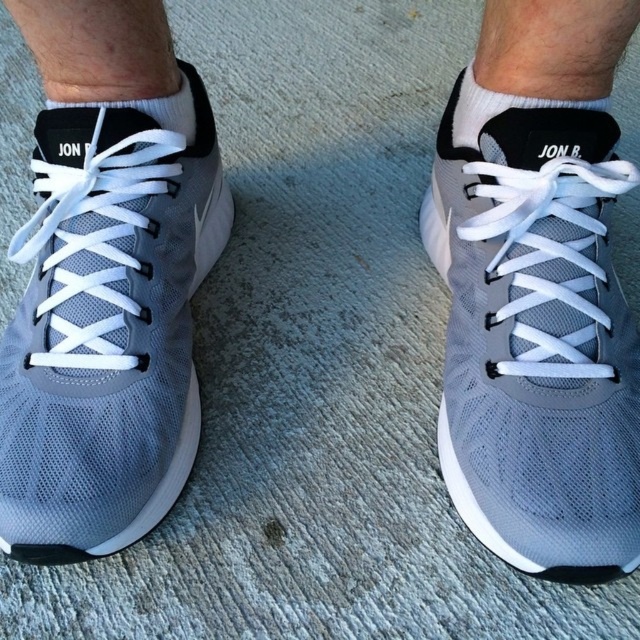
You are trying to put on your shoes but you notice something unusual. Are the matte gray shoe at center and the white cotton sock at upper center in the correct position for wearing? Explain why or why not.

The matte gray shoe at center is positioned under the white cotton sock at upper center, which is incorrect because socks are typically worn over shoes, not under them.

You are a photographer trying to capture the matte gray sneaker at left. Your camera is focused on the point at coordinates point (106, 326). Is the point you are focusing on the correct location for capturing the matte gray sneaker at left?

Yes, the point (106, 326) marks the matte gray sneaker at left, so focusing there will capture it correctly.